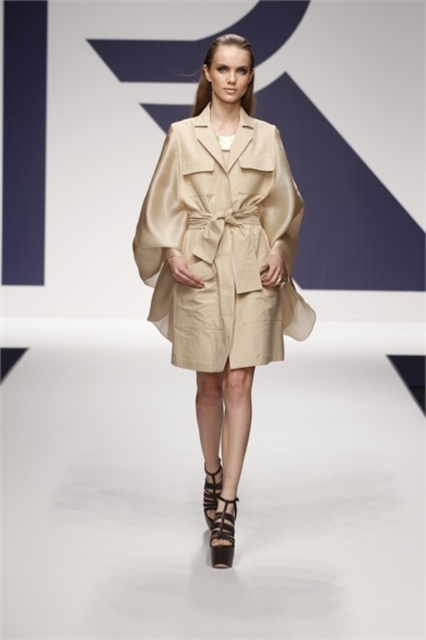
How far apart are leather/black textured sandal at lower center and brown leather sandal at lower center?

leather/black textured sandal at lower center is 24.04 centimeters away from brown leather sandal at lower center.

Looking at this image, does leather/black textured sandal at lower center have a lesser height compared to brown leather sandal at lower center?

Correct, leather/black textured sandal at lower center is not as tall as brown leather sandal at lower center.

Where is `leather/black textured sandal at lower center`? The image size is (426, 640). leather/black textured sandal at lower center is located at coordinates (222, 532).

Can you confirm if beige satin coat at center is wider than brown leather sandal at lower center?

Indeed, beige satin coat at center has a greater width compared to brown leather sandal at lower center.

Is point (210, 355) positioned before point (209, 522)?

Yes, point (210, 355) is closer to viewer.

Is point (216, 364) positioned after point (204, 515)?

No.

Find the location of a particular element. beige satin coat at center is located at coordinates (222, 250).

Is point (239, 51) more distant than point (222, 516)?

No, it is not.

Who is lower down, beige satin coat at center or leather/black textured sandal at lower center?

leather/black textured sandal at lower center is below.

I want to click on beige satin coat at center, so click(x=222, y=250).